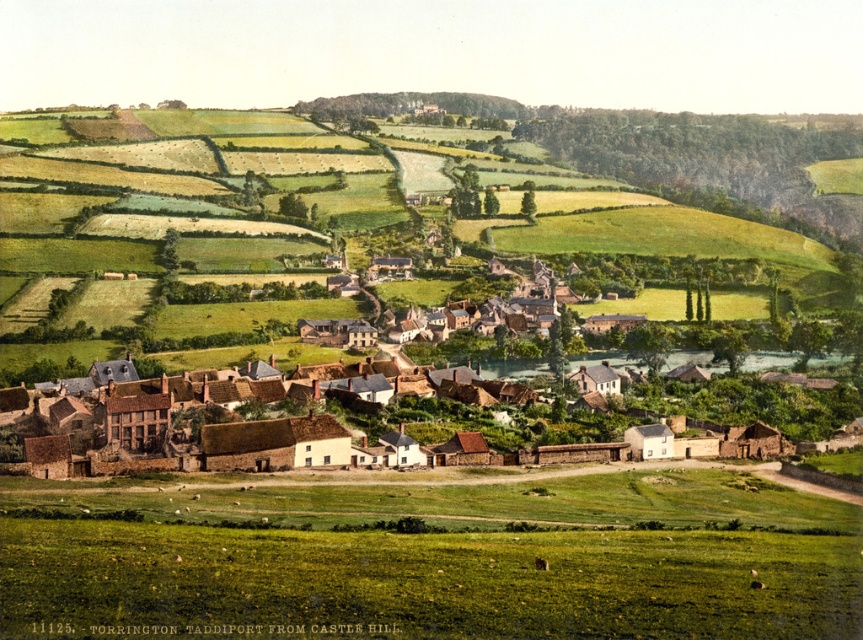
You are standing at the edge of a field and see the green grass at lower center and the brown brick houses at center. Which object is closer to you?

The green grass at lower center is closer to you because it is positioned in front of the brown brick houses at center.